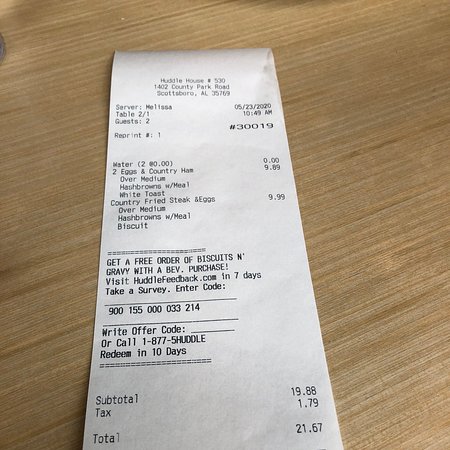
Locate an element on the screen. This screenshot has width=450, height=450. edge of silver plate is located at coordinates (1, 48).